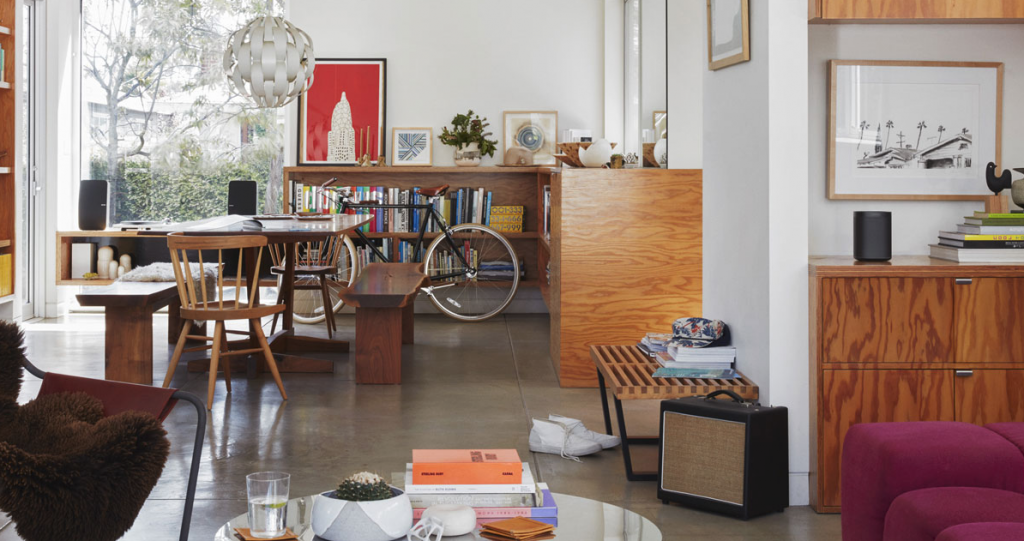
Image resolution: width=1024 pixels, height=541 pixels. Find the location of `chair`. chair is located at coordinates (227, 304).